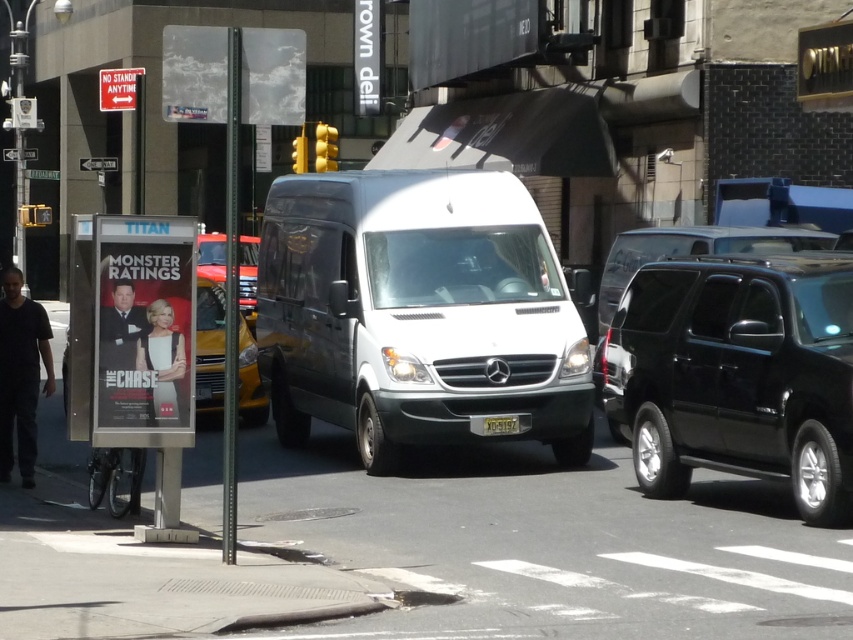
Who is more forward, (364, 340) or (666, 324)?

Point (666, 324) is in front.

Can you confirm if white glossy van at center is shorter than black metallic suv at right?

No.

Who is more distant from viewer, (299,410) or (785,348)?

The point (299,410) is more distant.

Locate an element on the screen. This screenshot has height=640, width=853. white glossy van at center is located at coordinates (416, 314).

The width and height of the screenshot is (853, 640). Describe the element at coordinates (209, 346) in the screenshot. I see `yellow metallic taxi cab at left` at that location.

Is yellow metallic taxi cab at left to the right of metallic silver van at center from the viewer's perspective?

No, yellow metallic taxi cab at left is not to the right of metallic silver van at center.

Locate an element on the screen. This screenshot has height=640, width=853. yellow metallic taxi cab at left is located at coordinates (209, 346).

Which is below, white glossy van at center or metallic silver van at center?

white glossy van at center

Who is more forward, (337, 172) or (254, 244)?

Point (337, 172)

Image resolution: width=853 pixels, height=640 pixels. Find the location of `white glossy van at center`. white glossy van at center is located at coordinates (416, 314).